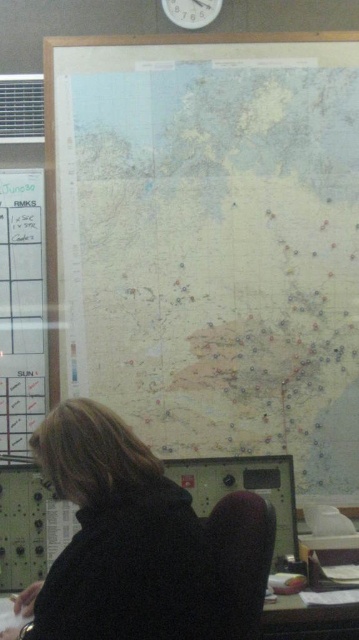
Which of these two, light beige paper map at center or dark brown hair at lower left, stands taller?

Standing taller between the two is light beige paper map at center.

Between point (129, 112) and point (138, 508), which one is positioned behind?

Positioned behind is point (129, 112).

The width and height of the screenshot is (359, 640). Find the location of `light beige paper map at center`. light beige paper map at center is located at coordinates (211, 243).

Is dark brown hair at lower left closer to the viewer compared to white plastic clock at upper center?

Yes, it is.

From the picture: Can you confirm if dark brown hair at lower left is positioned to the left of white plastic clock at upper center?

Correct, you'll find dark brown hair at lower left to the left of white plastic clock at upper center.

Which is in front, point (86, 637) or point (174, 13)?

Positioned in front is point (86, 637).

The height and width of the screenshot is (640, 359). I want to click on dark brown hair at lower left, so click(x=117, y=538).

Is wooden desk at lower center to the left of white plastic clock at upper center from the viewer's perspective?

Incorrect, wooden desk at lower center is not on the left side of white plastic clock at upper center.

Describe the element at coordinates (309, 620) in the screenshot. This screenshot has width=359, height=640. I see `wooden desk at lower center` at that location.

Does point (313, 628) lie behind point (203, 19)?

No, it is not.

You are a GUI agent. You are given a task and a screenshot of the screen. Output one action in this format:
    pyautogui.click(x=<x>, y=<y>)
    Task: Click on the wooden desk at lower center
    The width and height of the screenshot is (359, 640).
    Given the screenshot: What is the action you would take?
    pyautogui.click(x=309, y=620)